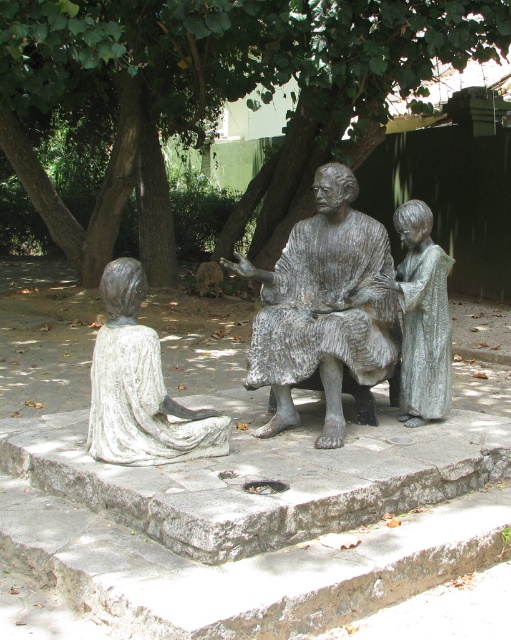
Question: Does bronze textured figure at center appear over shiny silver statue at right?

Choices:
 (A) no
 (B) yes

Answer: (B)

Question: Which object appears closest to the camera in this image?

Choices:
 (A) white marble statue at lower left
 (B) bronze textured figure at center
 (C) green leafy tree at center

Answer: (A)

Question: Which of the following is the farthest from the observer?

Choices:
 (A) (337, 401)
 (B) (137, 412)
 (C) (476, 42)
 (D) (448, 410)

Answer: (C)

Question: Is bronze textured figure at center smaller than shiny silver statue at right?

Choices:
 (A) no
 (B) yes

Answer: (A)

Question: From the image, what is the correct spatial relationship of green leafy tree at center in relation to white marble statue at lower left?

Choices:
 (A) right
 (B) left

Answer: (B)

Question: Which point appears closest to the camera in this image?

Choices:
 (A) (447, 323)
 (B) (175, 28)
 (C) (151, 464)
 (D) (287, 272)

Answer: (C)